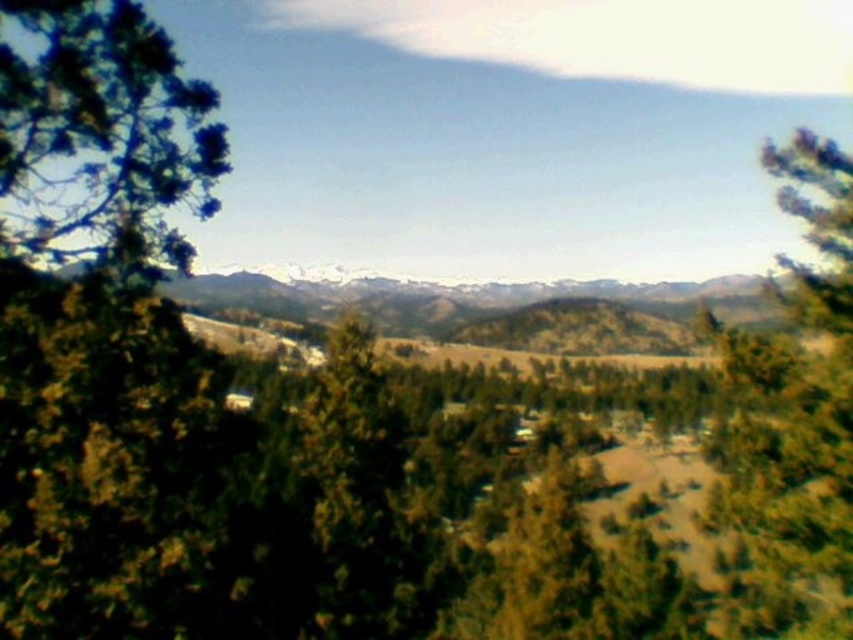
You are an environmental scientist assessing the growth patterns of trees in this landscape. You observe the green leafy tree at left and the green textured tree at right. Which tree would you expect to have a smaller canopy spread, and why?

The green leafy tree at left has a lesser height compared to the green textured tree at right. Since taller trees often have larger canopies, the green leafy tree at left likely has a smaller canopy spread due to its shorter stature.

You are planning to plant a new tree in your backyard. You have two options from the image, the green leafy tree at left and the green textured tree at right. Which tree has a narrower trunk?

The green leafy tree at left has a narrower trunk than the green textured tree at right according to the description.